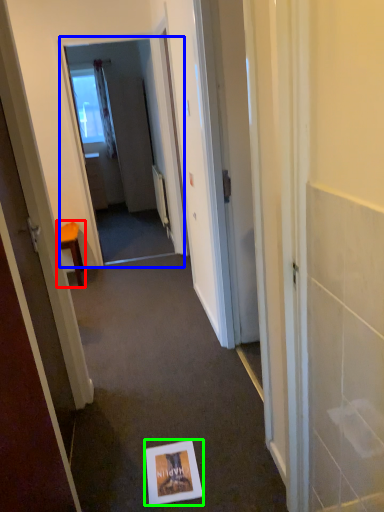
Question: Estimate the real-world distances between objects in this image. Which object is farther from furniture (highlighted by a red box), screen door (highlighted by a blue box) or postcard (highlighted by a green box)?

Choices:
 (A) screen door
 (B) postcard

Answer: (B)